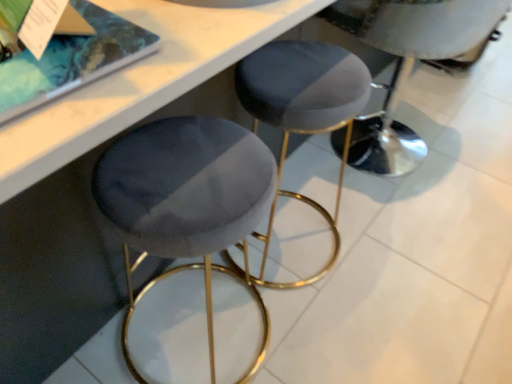
Where is `vacant region to the right of velvet grey stool at center`? vacant region to the right of velvet grey stool at center is located at coordinates (471, 147).